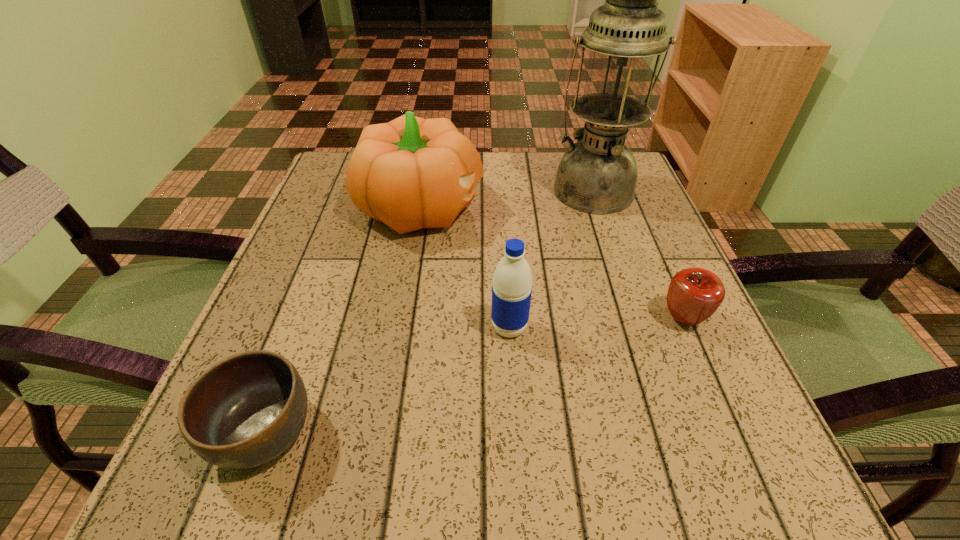
Where is `free space located 0.050m on the right of the nearest object`? free space located 0.050m on the right of the nearest object is located at coordinates 354,433.

Locate an element on the screen. The width and height of the screenshot is (960, 540). oil lamp that is at the far edge is located at coordinates (598, 174).

Locate an element on the screen. pumpkin that is at the far edge is located at coordinates (411, 173).

Where is `object that is at the near edge`? The width and height of the screenshot is (960, 540). object that is at the near edge is located at coordinates (x=244, y=411).

Image resolution: width=960 pixels, height=540 pixels. I want to click on pumpkin positioned at the left edge, so click(x=411, y=173).

Locate an element on the screen. The width and height of the screenshot is (960, 540). bowl at the left edge is located at coordinates (244, 411).

Locate an element on the screen. oil lamp that is at the right edge is located at coordinates (598, 174).

The height and width of the screenshot is (540, 960). In order to click on apple that is positioned at the right edge in this screenshot , I will do `click(694, 294)`.

Find the location of a particular element. The height and width of the screenshot is (540, 960). object present at the far left corner is located at coordinates click(x=411, y=173).

I want to click on object that is at the near left corner, so [244, 411].